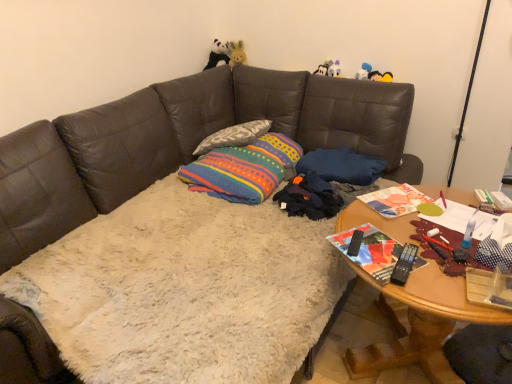
This screenshot has height=384, width=512. What do you see at coordinates (181, 142) in the screenshot? I see `white fluffy couch at center` at bounding box center [181, 142].

The height and width of the screenshot is (384, 512). Find the location of `multicolored fabric throw pillow at center`. multicolored fabric throw pillow at center is located at coordinates (243, 169).

What do you see at coordinates (243, 169) in the screenshot?
I see `multicolored fabric throw pillow at center` at bounding box center [243, 169].

Describe the element at coordinates (234, 136) in the screenshot. Image resolution: width=512 pixels, height=384 pixels. I see `textured gray pillow at center, placed as the 2th pillow when sorted from right to left` at that location.

Measure the distance between textured gray pillow at center, placed as the 2th pillow when sorted from right to left, and camera.

textured gray pillow at center, placed as the 2th pillow when sorted from right to left, and camera are 2.49 meters apart from each other.

You are a GUI agent. You are given a task and a screenshot of the screen. Output one action in this format:
    pyautogui.click(x=<x>, y=<y>)
    Task: Click on the wooden table at lower right
    This screenshot has width=512, height=384.
    Given the screenshot: What is the action you would take?
    pyautogui.click(x=422, y=325)

Consider the image. What is the approximate width of wooden table at lower right?

wooden table at lower right is 81.61 centimeters wide.

I want to click on white fluffy couch at center, so point(181,142).

Based on their sizes in the image, would you say white fluffy couch at center is bigger or smaller than blue fabric pillow at center, the first pillow when ordered from right to left?

In the image, white fluffy couch at center appears to be larger than blue fabric pillow at center, the first pillow when ordered from right to left.

Are white fluffy couch at center and blue fabric pillow at center, the first pillow when ordered from right to left, making contact?

No, white fluffy couch at center is not touching blue fabric pillow at center, the first pillow when ordered from right to left.

From a real-world perspective, which is physically below, white fluffy couch at center or blue fabric pillow at center, marked as the second pillow in a left-to-right arrangement?

white fluffy couch at center.

You are a GUI agent. You are given a task and a screenshot of the screen. Output one action in this format:
    pyautogui.click(x=<x>, y=<y>)
    Task: Click on the 2nd pillow in front when counting from the black plush panda at upper center
    This screenshot has height=384, width=512.
    Given the screenshot: What is the action you would take?
    tap(341, 166)

Considering the relative positions of black plush panda at upper center and blue fabric pillow at center, marked as the second pillow in a left-to-right arrangement, in the image provided, is black plush panda at upper center to the left or to the right of blue fabric pillow at center, marked as the second pillow in a left-to-right arrangement,?

From the image, it's evident that black plush panda at upper center is to the left of blue fabric pillow at center, marked as the second pillow in a left-to-right arrangement.

Between black plush panda at upper center and blue fabric pillow at center, the first pillow when ordered from right to left, which one has larger width?

With larger width is blue fabric pillow at center, the first pillow when ordered from right to left.

From the image's perspective, is black plush panda at upper center over blue fabric pillow at center, the first pillow when ordered from right to left?

Correct, black plush panda at upper center appears higher than blue fabric pillow at center, the first pillow when ordered from right to left, in the image.

Could you tell me if blue fabric pillow at center, marked as the second pillow in a left-to-right arrangement, is turned towards multicolored fabric throw pillow at center?

No, blue fabric pillow at center, marked as the second pillow in a left-to-right arrangement, is not aimed at multicolored fabric throw pillow at center.

Which is behind, point (369, 182) or point (224, 166)?

The point (224, 166) is more distant.

In the image, is blue fabric pillow at center, marked as the second pillow in a left-to-right arrangement, on the left side or the right side of multicolored fabric throw pillow at center?

blue fabric pillow at center, marked as the second pillow in a left-to-right arrangement, is to the right of multicolored fabric throw pillow at center.

Which object is more forward, blue fabric pillow at center, the first pillow when ordered from right to left, or multicolored fabric throw pillow at center?

multicolored fabric throw pillow at center.

Consider the image. Can you tell me how much blue fabric pillow at center, marked as the second pillow in a left-to-right arrangement, and white fluffy couch at center differ in facing direction?

The facing directions of blue fabric pillow at center, marked as the second pillow in a left-to-right arrangement, and white fluffy couch at center are 3.27 degrees apart.

Where is `studio couch in front of the blue fabric pillow at center, marked as the second pillow in a left-to-right arrangement`? studio couch in front of the blue fabric pillow at center, marked as the second pillow in a left-to-right arrangement is located at coordinates (181, 142).

Does blue fabric pillow at center, the first pillow when ordered from right to left, have a smaller size compared to white fluffy couch at center?

Correct, blue fabric pillow at center, the first pillow when ordered from right to left, occupies less space than white fluffy couch at center.

Can you confirm if blue fabric pillow at center, the first pillow when ordered from right to left, is wider than white fluffy couch at center?

Incorrect, the width of blue fabric pillow at center, the first pillow when ordered from right to left, does not surpass that of white fluffy couch at center.

Is wooden table at lower right looking in the opposite direction of multicolored fabric throw pillow at center?

Yes, multicolored fabric throw pillow at center is at the back of wooden table at lower right.

Is wooden table at lower right to the left of multicolored fabric throw pillow at center from the viewer's perspective?

In fact, wooden table at lower right is to the right of multicolored fabric throw pillow at center.

Is wooden table at lower right wider or thinner than multicolored fabric throw pillow at center?

In the image, wooden table at lower right appears to be wider than multicolored fabric throw pillow at center.

Is multicolored fabric throw pillow at center at the right side of black plush panda at upper center?

Indeed, multicolored fabric throw pillow at center is positioned on the right side of black plush panda at upper center.

From the picture: In terms of size, does multicolored fabric throw pillow at center appear bigger or smaller than black plush panda at upper center?

multicolored fabric throw pillow at center is bigger than black plush panda at upper center.

From a real-world perspective, is multicolored fabric throw pillow at center on top of black plush panda at upper center?

No, from a real-world perspective, multicolored fabric throw pillow at center is not over black plush panda at upper center

From the image's perspective, which is above, textured gray pillow at center, the first pillow viewed from the left, or blue fabric pillow at center, the first pillow when ordered from right to left?

textured gray pillow at center, the first pillow viewed from the left.

Considering the relative sizes of textured gray pillow at center, placed as the 2th pillow when sorted from right to left, and blue fabric pillow at center, the first pillow when ordered from right to left, in the image provided, is textured gray pillow at center, placed as the 2th pillow when sorted from right to left, taller than blue fabric pillow at center, the first pillow when ordered from right to left,?

In fact, textured gray pillow at center, placed as the 2th pillow when sorted from right to left, may be shorter than blue fabric pillow at center, the first pillow when ordered from right to left.

Would you say textured gray pillow at center, the first pillow viewed from the left, is inside or outside blue fabric pillow at center, marked as the second pillow in a left-to-right arrangement?

textured gray pillow at center, the first pillow viewed from the left, cannot be found inside blue fabric pillow at center, marked as the second pillow in a left-to-right arrangement.

Is textured gray pillow at center, placed as the 2th pillow when sorted from right to left, positioned far away from blue fabric pillow at center, the first pillow when ordered from right to left?

textured gray pillow at center, placed as the 2th pillow when sorted from right to left, is near blue fabric pillow at center, the first pillow when ordered from right to left, not far away.

Locate an element on the screen. The image size is (512, 384). pillow that is the 1st one when counting backward from the white fluffy couch at center is located at coordinates (341, 166).

The image size is (512, 384). What are the coordinates of `the 2nd pillow to the right when counting from the black plush panda at upper center` in the screenshot? It's located at (341, 166).

Looking at the image, which one is located closer to textured gray pillow at center, the first pillow viewed from the left, blue fabric pillow at center, the first pillow when ordered from right to left, or white fluffy couch at center?

Based on the image, white fluffy couch at center appears to be nearer to textured gray pillow at center, the first pillow viewed from the left.

Based on their spatial positions, is black plush panda at upper center or white fluffy couch at center further from wooden table at lower right?

black plush panda at upper center lies further to wooden table at lower right than the other object.

Looking at the image, which one is located closer to multicolored fabric throw pillow at center, textured gray pillow at center, placed as the 2th pillow when sorted from right to left, or wooden table at lower right?

The object closer to multicolored fabric throw pillow at center is textured gray pillow at center, placed as the 2th pillow when sorted from right to left.

Consider the image. From the image, which object appears to be nearer to black plush panda at upper center, wooden table at lower right or multicolored fabric throw pillow at center?

Based on the image, multicolored fabric throw pillow at center appears to be nearer to black plush panda at upper center.

Looking at the image, which one is located closer to white fluffy couch at center, blue fabric pillow at center, marked as the second pillow in a left-to-right arrangement, or black plush panda at upper center?

blue fabric pillow at center, marked as the second pillow in a left-to-right arrangement, is positioned closer to the anchor white fluffy couch at center.

From the image, which object appears to be nearer to blue fabric pillow at center, the first pillow when ordered from right to left, textured gray pillow at center, placed as the 2th pillow when sorted from right to left, or multicolored fabric throw pillow at center?

multicolored fabric throw pillow at center lies closer to blue fabric pillow at center, the first pillow when ordered from right to left, than the other object.

When comparing their distances from multicolored fabric throw pillow at center, does wooden table at lower right or white fluffy couch at center seem closer?

The object closer to multicolored fabric throw pillow at center is white fluffy couch at center.

Based on their spatial positions, is multicolored fabric throw pillow at center or blue fabric pillow at center, the first pillow when ordered from right to left, closer to black plush panda at upper center?

The object closer to black plush panda at upper center is multicolored fabric throw pillow at center.

Where is `throw pillow positioned between white fluffy couch at center and blue fabric pillow at center, marked as the second pillow in a left-to-right arrangement, from near to far`? This screenshot has height=384, width=512. throw pillow positioned between white fluffy couch at center and blue fabric pillow at center, marked as the second pillow in a left-to-right arrangement, from near to far is located at coordinates (243, 169).

Image resolution: width=512 pixels, height=384 pixels. I want to click on pillow between white fluffy couch at center and textured gray pillow at center, placed as the 2th pillow when sorted from right to left, in the front-back direction, so click(x=341, y=166).

Locate an element on the screen. The width and height of the screenshot is (512, 384). table positioned between white fluffy couch at center and multicolored fabric throw pillow at center from near to far is located at coordinates (422, 325).

I want to click on table between white fluffy couch at center and textured gray pillow at center, the first pillow viewed from the left, in the front-back direction, so [x=422, y=325].